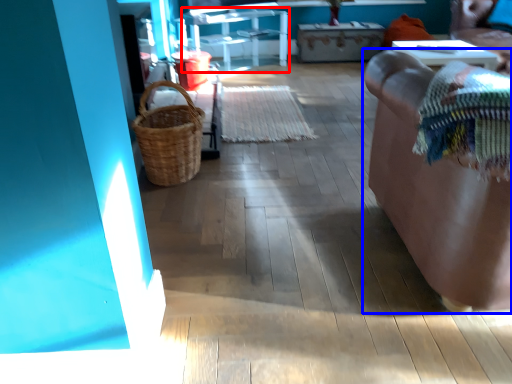
Question: Which of the following is the closest to the observer, furniture (highlighted by a red box) or furniture (highlighted by a blue box)?

Choices:
 (A) furniture
 (B) furniture

Answer: (B)